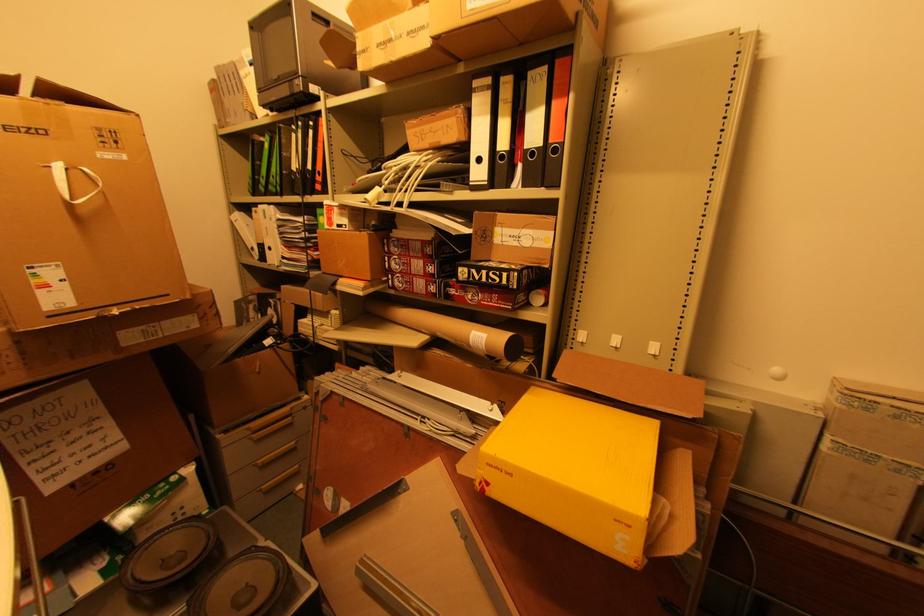
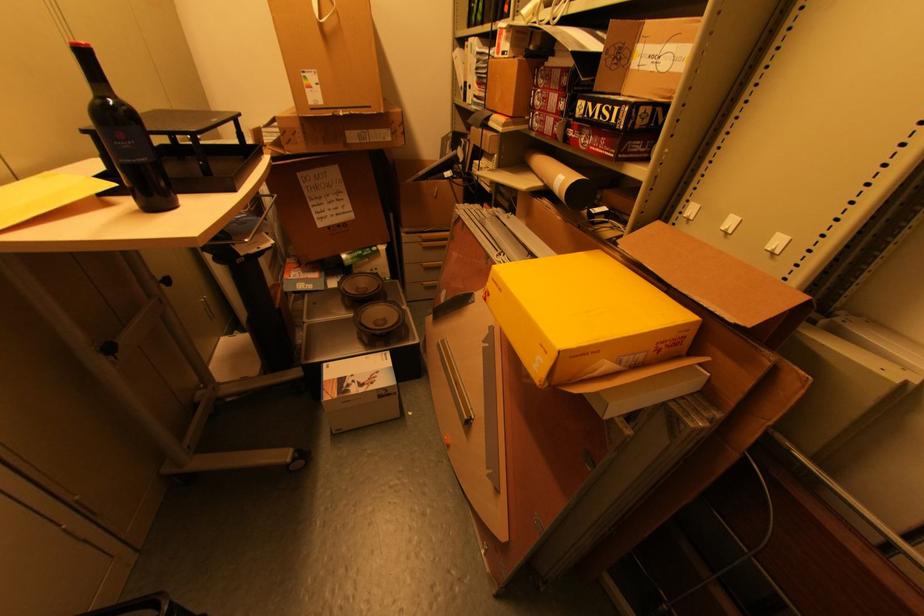
In the second image, find the point that corresponds to pixel 77 199 in the first image.

(323, 18)